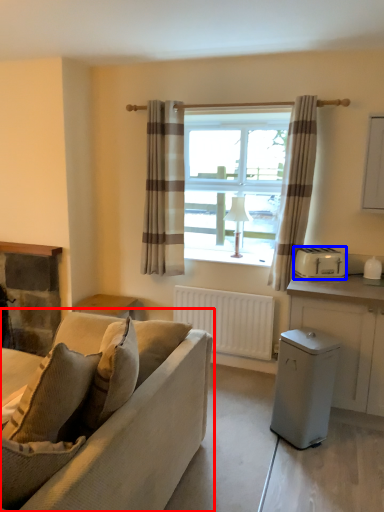
Question: Among these objects, which one is farthest to the camera, studio couch (highlighted by a red box) or appliance (highlighted by a blue box)?

Choices:
 (A) studio couch
 (B) appliance

Answer: (B)